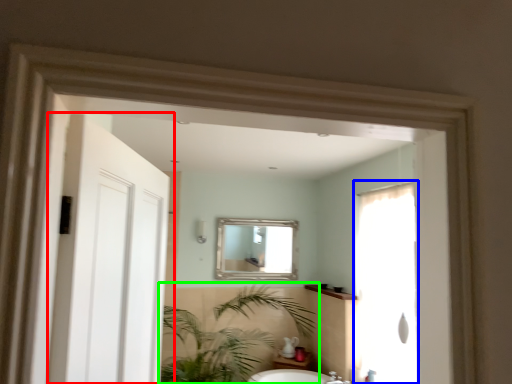
Question: Which is nearer to the door (highlighted by a red box)? screen door (highlighted by a blue box) or houseplant (highlighted by a green box).

Choices:
 (A) screen door
 (B) houseplant

Answer: (A)